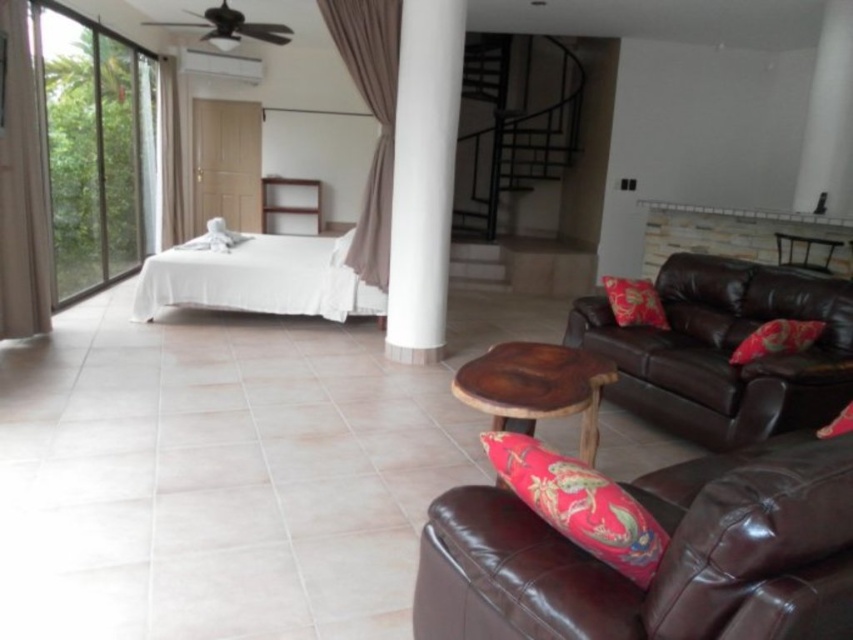
From the picture: Can you confirm if white sheer curtain at left is thinner than brown leather armchair at upper right?

Yes, white sheer curtain at left is thinner than brown leather armchair at upper right.

Can you confirm if white sheer curtain at left is positioned below brown leather armchair at upper right?

No.

Who is more forward, [180,84] or [805,257]?

Positioned in front is point [805,257].

Locate an element on the screen. The height and width of the screenshot is (640, 853). white sheer curtain at left is located at coordinates (173, 156).

Is white sheer curtain at left wider than red satin pillow at lower right?

Yes.

The height and width of the screenshot is (640, 853). Describe the element at coordinates (173, 156) in the screenshot. I see `white sheer curtain at left` at that location.

Which is in front, point (186, 212) or point (828, 429)?

Point (828, 429) is in front.

Identify the location of white sheer curtain at left. The width and height of the screenshot is (853, 640). (173, 156).

Is brown leather couch at right closer to the viewer compared to red satin cushion at lower right?

No, brown leather couch at right is behind red satin cushion at lower right.

The image size is (853, 640). What are the coordinates of `brown leather couch at right` in the screenshot? It's located at (724, 349).

Identify the location of brown leather couch at right. The height and width of the screenshot is (640, 853). pyautogui.click(x=724, y=349).